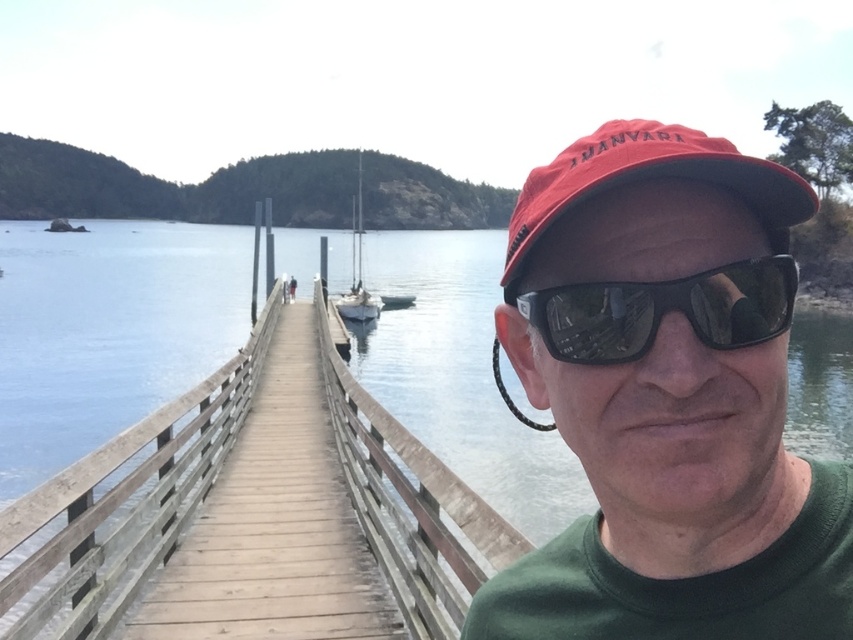
Question: Estimate the real-world distances between objects in this image. Which object is farther from the wooden at center?

Choices:
 (A) red matte cap at center
 (B) matte red cap at center

Answer: (A)

Question: Which object appears farthest from the camera in this image?

Choices:
 (A) wooden at center
 (B) white matte sailboat at center
 (C) matte red cap at center
 (D) red matte cap at center

Answer: (B)

Question: Is wooden at center above black reflective sunglasses at center?

Choices:
 (A) yes
 (B) no

Answer: (B)

Question: Is wooden at center bigger than black reflective sunglasses at center?

Choices:
 (A) yes
 (B) no

Answer: (A)

Question: Where is red matte cap at center located in relation to white matte sailboat at center in the image?

Choices:
 (A) right
 (B) left

Answer: (A)

Question: Among these objects, which one is nearest to the camera?

Choices:
 (A) red matte cap at center
 (B) black reflective sunglasses at center

Answer: (A)